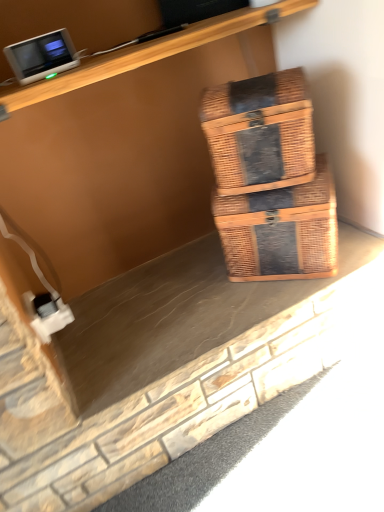
The image size is (384, 512). What do you see at coordinates (259, 131) in the screenshot?
I see `woven brown box at center, arranged as the 2th box when ordered from the bottom` at bounding box center [259, 131].

Measure the distance between point (332,204) and camera.

Point (332,204) and camera are 3.58 feet apart from each other.

Measure the distance between point (23, 61) and camera.

Point (23, 61) is 37.72 inches from camera.

I want to click on woven brown box at center, which appears as the first box when viewed from the top, so click(259, 131).

From the image's perspective, relative to white plastic electric outlet at lower left, is woven brown box at center, arranged as the 2th box when ordered from the bottom, above or below?

woven brown box at center, arranged as the 2th box when ordered from the bottom, is situated higher than white plastic electric outlet at lower left in the image.

From the picture: From a real-world perspective, is woven brown box at center, which appears as the first box when viewed from the top, located higher than white plastic electric outlet at lower left?

Indeed, from a real-world perspective, woven brown box at center, which appears as the first box when viewed from the top, stands above white plastic electric outlet at lower left.

Is woven brown box at center, which appears as the first box when viewed from the top, smaller than white plastic electric outlet at lower left?

No.

Considering the positions of objects woven brown box at center, arranged as the 2th box when ordered from the bottom, and white plastic electric outlet at lower left in the image provided, who is behind, woven brown box at center, arranged as the 2th box when ordered from the bottom, or white plastic electric outlet at lower left?

white plastic electric outlet at lower left is further away from the camera.

Is woven brown box at center, which is counted as the 2th box, starting from the top, with matte gray monitor at upper left?

No, woven brown box at center, which is counted as the 2th box, starting from the top, is not making contact with matte gray monitor at upper left.

Can you confirm if woven brown box at center, which is counted as the 2th box, starting from the top, is thinner than matte gray monitor at upper left?

Incorrect, the width of woven brown box at center, which is counted as the 2th box, starting from the top, is not less than that of matte gray monitor at upper left.

Is woven brown box at center, which is counted as the 2th box, starting from the top, oriented away from matte gray monitor at upper left?

That's not correct — woven brown box at center, which is counted as the 2th box, starting from the top, is not looking away from matte gray monitor at upper left.

Is white plastic electric outlet at lower left inside or outside of woven brown box at center, which appears as the first box when viewed from the top?

white plastic electric outlet at lower left lies outside woven brown box at center, which appears as the first box when viewed from the top.

Which is more to the right, white plastic electric outlet at lower left or woven brown box at center, arranged as the 2th box when ordered from the bottom?

From the viewer's perspective, woven brown box at center, arranged as the 2th box when ordered from the bottom, appears more on the right side.

From the picture: Which of these two, white plastic electric outlet at lower left or woven brown box at center, arranged as the 2th box when ordered from the bottom, is bigger?

With larger size is woven brown box at center, arranged as the 2th box when ordered from the bottom.

Where is `electric outlet beneath the matte gray monitor at upper left (from a real-world perspective)`? This screenshot has height=512, width=384. electric outlet beneath the matte gray monitor at upper left (from a real-world perspective) is located at coordinates (47, 314).

Can you see matte gray monitor at upper left touching white plastic electric outlet at lower left?

No, matte gray monitor at upper left is not beside white plastic electric outlet at lower left.

Is matte gray monitor at upper left further to the viewer compared to white plastic electric outlet at lower left?

No, the depth of matte gray monitor at upper left is less than that of white plastic electric outlet at lower left.

From a real-world perspective, which object stands above the other?

woven brown box at center, which appears as the first box when viewed from the top, from a real-world perspective.

From the picture: Would you say woven brown box at center, which ranks as the 1th box in bottom-to-top order, is inside or outside woven brown box at center, arranged as the 2th box when ordered from the bottom?

woven brown box at center, which ranks as the 1th box in bottom-to-top order, is not inside woven brown box at center, arranged as the 2th box when ordered from the bottom, it's outside.

At what (x,y) coordinates should I click in order to perform the action: click on box below the woven brown box at center, arranged as the 2th box when ordered from the bottom (from the image's perspective). Please return your answer as a coordinate pair (x, y). Image resolution: width=384 pixels, height=512 pixels. Looking at the image, I should click on (281, 229).

Is woven brown box at center, which is counted as the 2th box, starting from the top, at the right side of woven brown box at center, which appears as the first box when viewed from the top?

Indeed, woven brown box at center, which is counted as the 2th box, starting from the top, is positioned on the right side of woven brown box at center, which appears as the first box when viewed from the top.

Between woven brown box at center, which is counted as the 2th box, starting from the top, and white plastic electric outlet at lower left, which one appears on the left side from the viewer's perspective?

white plastic electric outlet at lower left.

Between woven brown box at center, which ranks as the 1th box in bottom-to-top order, and white plastic electric outlet at lower left, which one is positioned in front?

woven brown box at center, which ranks as the 1th box in bottom-to-top order, is more forward.

From a real-world perspective, is woven brown box at center, which ranks as the 1th box in bottom-to-top order, physically located above or below white plastic electric outlet at lower left?

woven brown box at center, which ranks as the 1th box in bottom-to-top order, is above white plastic electric outlet at lower left.

Identify the location of electric outlet behind the woven brown box at center, which is counted as the 2th box, starting from the top. This screenshot has height=512, width=384. (47, 314).

From a real-world perspective, is matte gray monitor at upper left on woven brown box at center, which ranks as the 1th box in bottom-to-top order?

Correct, in the physical world, matte gray monitor at upper left is higher than woven brown box at center, which ranks as the 1th box in bottom-to-top order.

Is point (64, 57) farther from camera compared to point (269, 198)?

No, (64, 57) is closer to viewer.

From the image's perspective, is matte gray monitor at upper left below woven brown box at center, which ranks as the 1th box in bottom-to-top order?

No, from the image's perspective, matte gray monitor at upper left is not beneath woven brown box at center, which ranks as the 1th box in bottom-to-top order.

Is matte gray monitor at upper left closer to the viewer compared to woven brown box at center, which ranks as the 1th box in bottom-to-top order?

Yes, it is.

Find the location of a particular element. The height and width of the screenshot is (512, 384). box that is the 1st object to the right of the white plastic electric outlet at lower left, starting at the anchor is located at coordinates (259, 131).

Where is `the 2nd box behind the matte gray monitor at upper left`? Image resolution: width=384 pixels, height=512 pixels. the 2nd box behind the matte gray monitor at upper left is located at coordinates (281, 229).

Estimate the real-world distances between objects in this image. Which object is further from matte gray monitor at upper left, woven brown box at center, which appears as the first box when viewed from the top, or white plastic electric outlet at lower left?

Among the two, white plastic electric outlet at lower left is located further to matte gray monitor at upper left.

Based on their spatial positions, is woven brown box at center, which appears as the first box when viewed from the top, or white plastic electric outlet at lower left closer to woven brown box at center, which ranks as the 1th box in bottom-to-top order?

Based on the image, woven brown box at center, which appears as the first box when viewed from the top, appears to be nearer to woven brown box at center, which ranks as the 1th box in bottom-to-top order.

Considering their positions, is matte gray monitor at upper left positioned further to white plastic electric outlet at lower left than woven brown box at center, arranged as the 2th box when ordered from the bottom?

Among the two, woven brown box at center, arranged as the 2th box when ordered from the bottom, is located further to white plastic electric outlet at lower left.

Considering their positions, is woven brown box at center, which is counted as the 2th box, starting from the top, positioned further to matte gray monitor at upper left than white plastic electric outlet at lower left?

Based on the image, woven brown box at center, which is counted as the 2th box, starting from the top, appears to be further to matte gray monitor at upper left.

Considering their positions, is woven brown box at center, which is counted as the 2th box, starting from the top, positioned further to woven brown box at center, which appears as the first box when viewed from the top, than matte gray monitor at upper left?

matte gray monitor at upper left is further to woven brown box at center, which appears as the first box when viewed from the top.

Considering their positions, is woven brown box at center, which appears as the first box when viewed from the top, positioned further to woven brown box at center, which is counted as the 2th box, starting from the top, than matte gray monitor at upper left?

matte gray monitor at upper left.

Based on their spatial positions, is matte gray monitor at upper left or white plastic electric outlet at lower left further from woven brown box at center, which ranks as the 1th box in bottom-to-top order?

Among the two, matte gray monitor at upper left is located further to woven brown box at center, which ranks as the 1th box in bottom-to-top order.

Estimate the real-world distances between objects in this image. Which object is closer to matte gray monitor at upper left, white plastic electric outlet at lower left or woven brown box at center, arranged as the 2th box when ordered from the bottom?

woven brown box at center, arranged as the 2th box when ordered from the bottom.

Where is `box located between matte gray monitor at upper left and woven brown box at center, which is counted as the 2th box, starting from the top, in the left-right direction`? box located between matte gray monitor at upper left and woven brown box at center, which is counted as the 2th box, starting from the top, in the left-right direction is located at coordinates (259, 131).

Where is `desktop computer between white plastic electric outlet at lower left and woven brown box at center, which ranks as the 1th box in bottom-to-top order, in the horizontal direction`? The width and height of the screenshot is (384, 512). desktop computer between white plastic electric outlet at lower left and woven brown box at center, which ranks as the 1th box in bottom-to-top order, in the horizontal direction is located at coordinates (x=42, y=56).

In order to click on box between white plastic electric outlet at lower left and woven brown box at center, which ranks as the 1th box in bottom-to-top order, in the horizontal direction in this screenshot , I will do `click(259, 131)`.